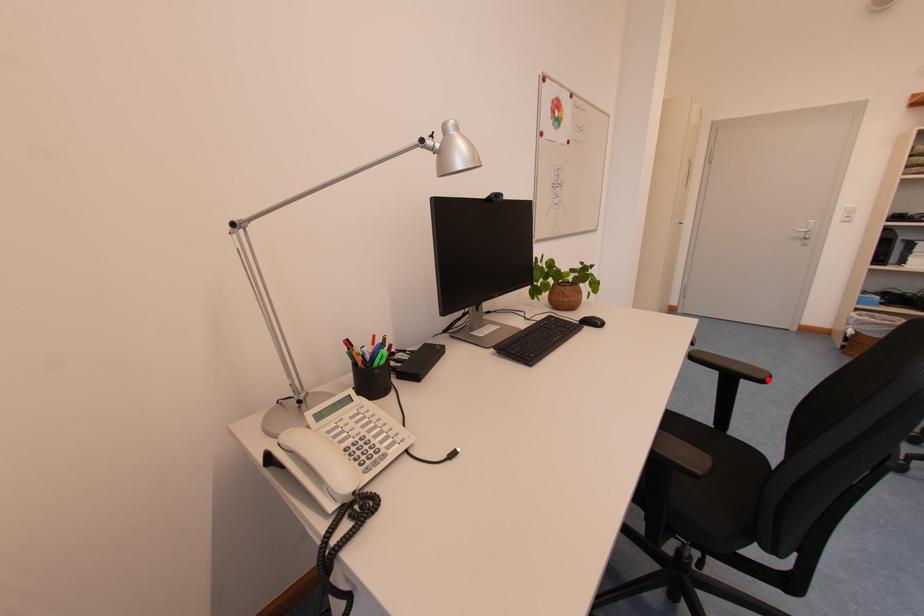
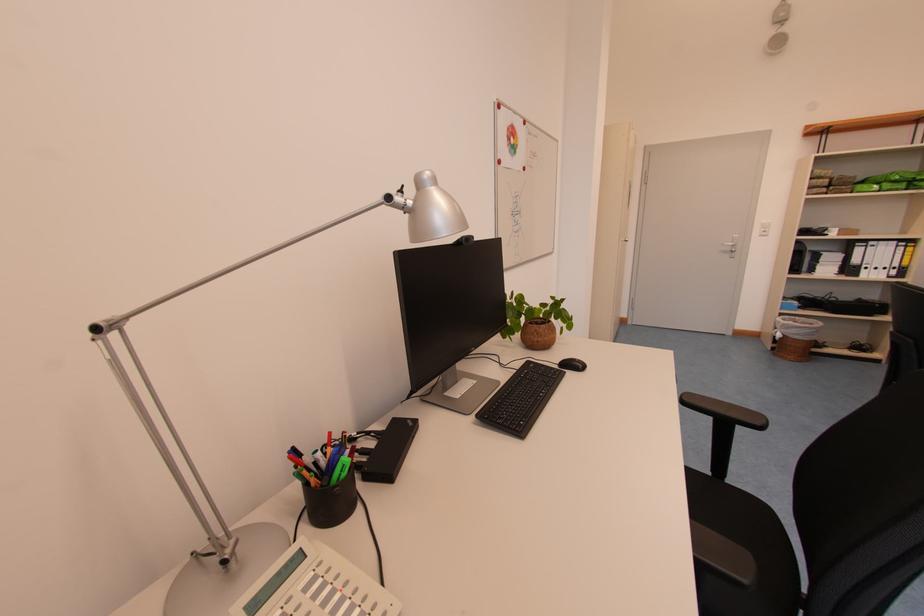
The point at the highlighted location is marked in the first image. Where is the corresponding point in the second image?

(766, 426)